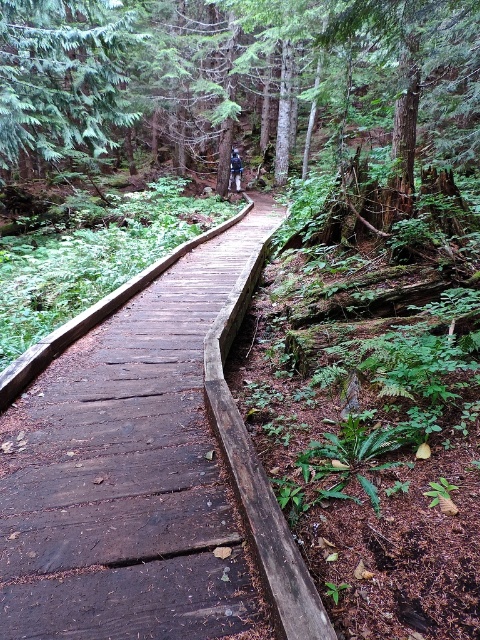
Question: Which object is closer to the camera taking this photo?

Choices:
 (A) brown wooden boardwalk at center
 (B) green matte tree at upper left

Answer: (A)

Question: Does brown wooden boardwalk at center have a lesser width compared to green matte tree at upper left?

Choices:
 (A) no
 (B) yes

Answer: (B)

Question: Is brown wooden boardwalk at center wider than green matte tree at upper left?

Choices:
 (A) yes
 (B) no

Answer: (B)

Question: Is brown wooden boardwalk at center smaller than green matte tree at upper left?

Choices:
 (A) no
 (B) yes

Answer: (B)